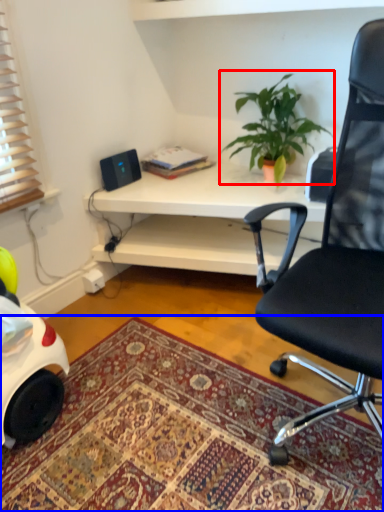
Question: Which object is further to the camera taking this photo, houseplant (highlighted by a red box) or mat (highlighted by a blue box)?

Choices:
 (A) houseplant
 (B) mat

Answer: (A)